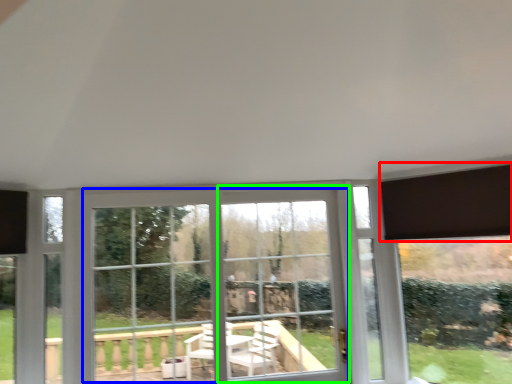
Question: Considering the real-world distances, which object is farthest from curtain (highlighted by a red box)? bay window (highlighted by a blue box) or window frame (highlighted by a green box)?

Choices:
 (A) bay window
 (B) window frame

Answer: (A)